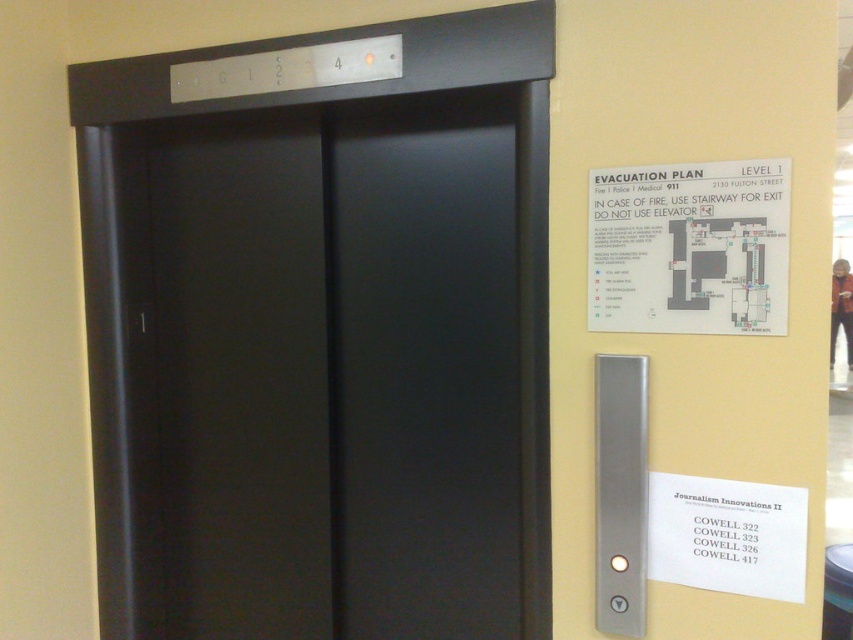
Question: Does satin black door at center come in front of white paper map at upper right?

Choices:
 (A) yes
 (B) no

Answer: (B)

Question: Which object is farther from the camera taking this photo?

Choices:
 (A) matte black elevator at center
 (B) white paper map at upper right

Answer: (A)

Question: Does matte black elevator at center appear on the right side of white paper map at upper right?

Choices:
 (A) no
 (B) yes

Answer: (A)

Question: Among these objects, which one is nearest to the camera?

Choices:
 (A) satin black door at center
 (B) matte black elevator at center
 (C) white paper map at upper right

Answer: (C)

Question: Can you confirm if satin black door at center is positioned above white paper map at upper right?

Choices:
 (A) yes
 (B) no

Answer: (B)

Question: Estimate the real-world distances between objects in this image. Which object is closer to the satin black door at center?

Choices:
 (A) white paper map at upper right
 (B) matte black elevator at center

Answer: (B)